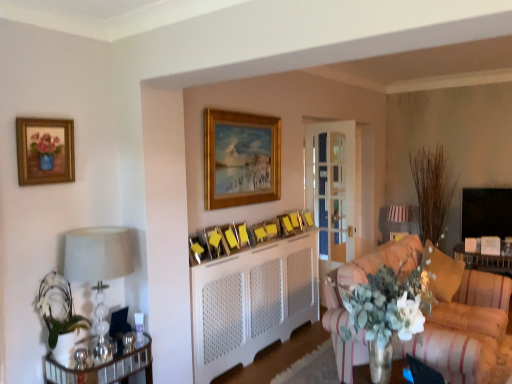
Question: Is wooden picture frame at center, which is the fourth picture frame in back-to-front order, inside or outside of white striped lampshade at upper right, the second lamp viewed from the front?

Choices:
 (A) outside
 (B) inside

Answer: (A)

Question: From a real-world perspective, is wooden picture frame at center, which is the fourth picture frame in back-to-front order, positioned above or below white striped lampshade at upper right, which ranks as the first lamp in back-to-front order?

Choices:
 (A) above
 (B) below

Answer: (A)

Question: Which object is positioned closest to the white ceramic vase at left?

Choices:
 (A) wooden picture frame at center, the sixth picture frame when ordered from front to back
 (B) wooden picture frame at center, the 9th picture frame positioned from the front
 (C) white textured radiator at center
 (D) white glass lampshade at left, the 2th lamp from the right
 (E) wooden picture frame at center, positioned as the 10th picture frame in front-to-back order

Answer: (D)

Question: Which is farther from the wooden picture frame at center, the 9th picture frame in the back-to-front sequence?

Choices:
 (A) wooden picture frame at center, the 9th picture frame positioned from the front
 (B) velvet gold pillow at right
 (C) white ceramic vase at left
 (D) white striped lampshade at upper right, marked as the second lamp in a left-to-right arrangement
 (E) gold-framed painting at upper center, which ranks as the fourth picture frame in front-to-back order

Answer: (D)